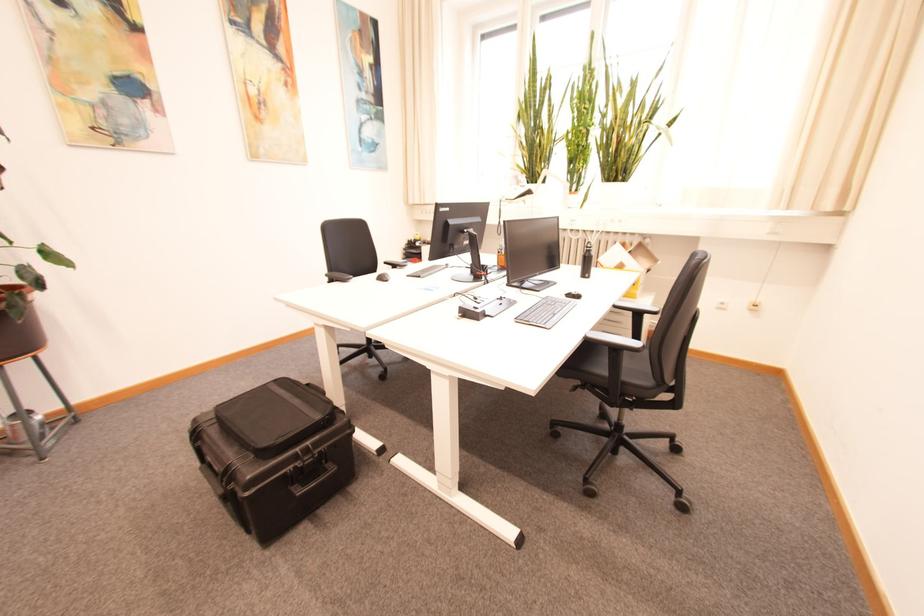
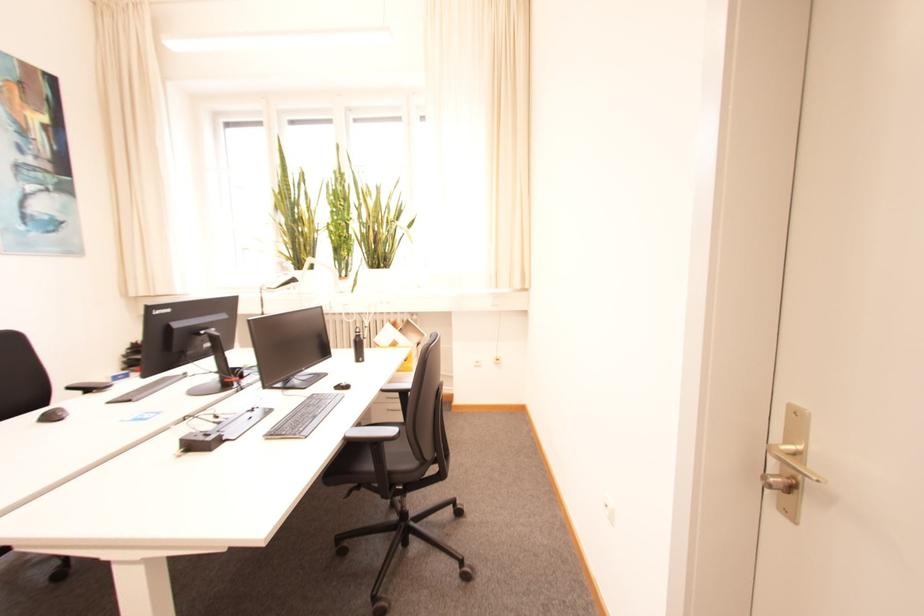
Question: The camera is either moving clockwise (left) or counter-clockwise (right) around the object. The first image is from the beginning of the video and the second image is from the end. Is the camera moving left or right when shooting the video?

Choices:
 (A) Left
 (B) Right

Answer: (A)